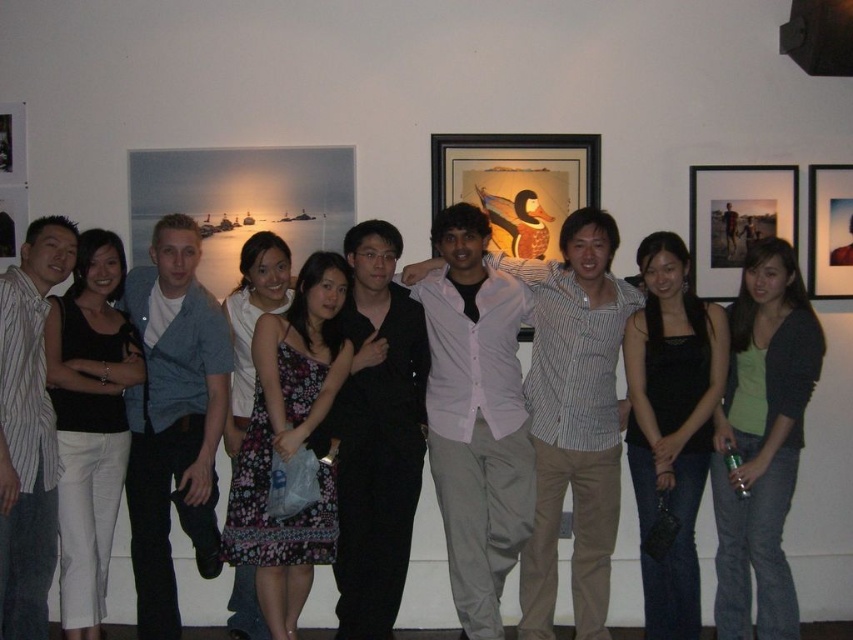
You are a photographer setting up for a group photo at an art gallery. You need to ensure that the striped cotton shirt at left and the wooden framed picture at center are both in focus. The camera you are using has a depth of field that can cover 2 meters. Will both subjects be in focus?

The distance between the striped cotton shirt at left and the wooden framed picture at center is 2.08 meters. Since the depth of field covers 2 meters, the subjects are slightly out of the camera range. Adjust your camera settings or move closer to ensure both are in focus.

You are a photographer trying to capture a clear shot of both the black satin tank top at center and the matte black portrait at upper right. Since both are black, you need to adjust your camera settings to distinguish them. Based on their sizes, which object should you focus on first to ensure proper exposure?

The black satin tank top at center is taller than the matte black portrait at upper right, so you should focus on the black satin tank top at center first to ensure proper exposure, as it is larger and may require more precise adjustments.